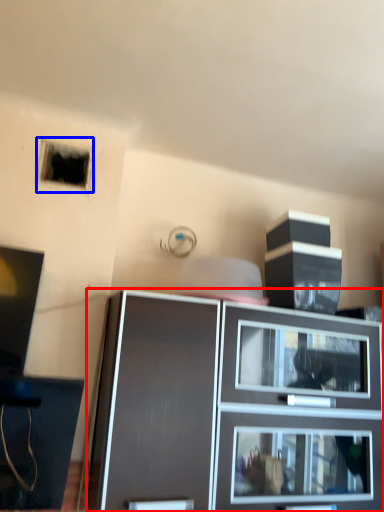
Question: Which object appears closest to the camera in this image, cabinetry (highlighted by a red box) or hole (highlighted by a blue box)?

Choices:
 (A) cabinetry
 (B) hole

Answer: (A)